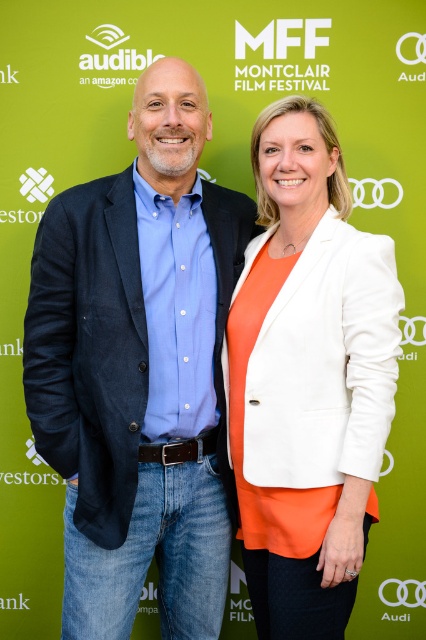
Question: Which object appears farthest from the camera in this image?

Choices:
 (A) blue denim jeans at center
 (B) white matte blazer at center

Answer: (A)

Question: Does blue denim jeans at center have a smaller size compared to white matte blazer at center?

Choices:
 (A) yes
 (B) no

Answer: (B)

Question: Which point is closer to the camera taking this photo?

Choices:
 (A) (293, 534)
 (B) (166, 588)

Answer: (A)

Question: Does blue denim jeans at center have a larger size compared to white matte blazer at center?

Choices:
 (A) no
 (B) yes

Answer: (B)

Question: Is blue denim jeans at center bigger than white matte blazer at center?

Choices:
 (A) yes
 (B) no

Answer: (A)

Question: Among these objects, which one is farthest from the camera?

Choices:
 (A) white matte blazer at center
 (B) blue denim jeans at center

Answer: (B)